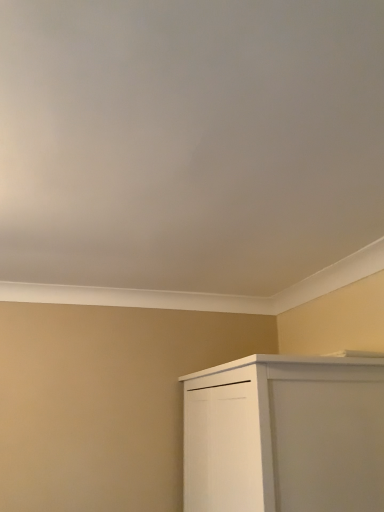
This screenshot has width=384, height=512. I want to click on white matte cabinet at lower right, so click(285, 435).

This screenshot has height=512, width=384. What do you see at coordinates (285, 435) in the screenshot?
I see `white matte cabinet at lower right` at bounding box center [285, 435].

Find the location of a particular element. The image size is (384, 512). white matte cabinet at lower right is located at coordinates (285, 435).